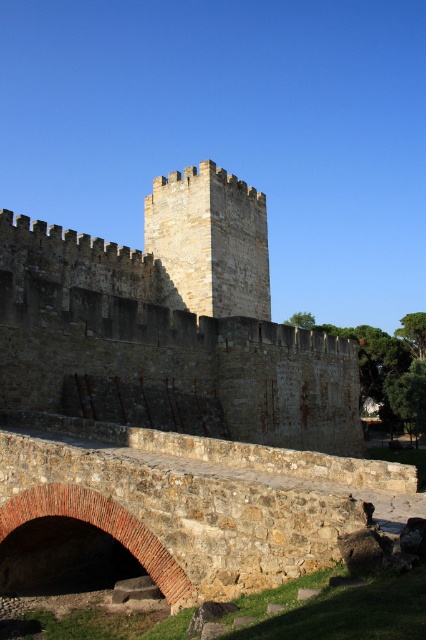
Is stone textured tower at center positioned before brick archway at lower left?

That is False.

Locate an element on the screen. stone textured tower at center is located at coordinates (209, 243).

Which of these two, stone tower at center or stone textured tower at center, stands taller?

stone tower at center is taller.

The image size is (426, 640). Identify the location of stone tower at center. (170, 324).

Is stone tower at center to the left of brick archway at lower left from the viewer's perspective?

Incorrect, stone tower at center is not on the left side of brick archway at lower left.

Does stone tower at center appear over brick archway at lower left?

Yes, stone tower at center is above brick archway at lower left.

Locate an element on the screen. stone tower at center is located at coordinates (170, 324).